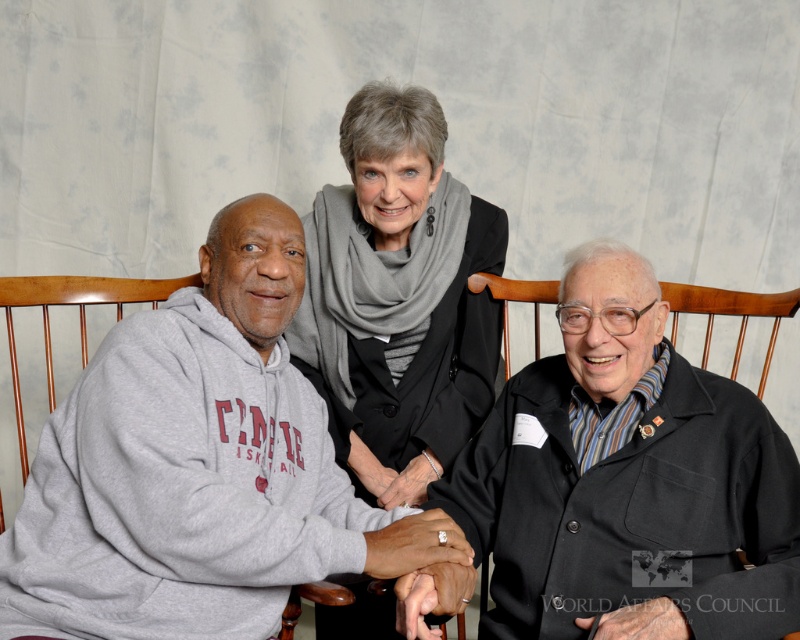
You are a photographer at an event and need to adjust the lighting so that both the gray hoodie at left and the gray wool scarf at center are equally visible. Considering their sizes, which object requires more light to achieve this?

The gray hoodie at left is shorter than the gray wool scarf at center, so it requires more light to ensure it is as visible as the scarf.

You are a photographer at an event and need to adjust the lighting to ensure both the gray hoodie at left and the black wool coat at right are well illuminated. Given their height difference, which object should you position closer to the light source?

The gray hoodie at left is much taller than the black wool coat at right, so you should position the gray hoodie at left closer to the light source to ensure both receive adequate illumination.

You are a photographer trying to capture a group photo of the gray hoodie at left and the black wool coat at right. The camera you are using has a minimum focusing distance of 16 inches. Can you take a clear photo of both subjects without moving them?

The gray hoodie at left is 16.29 inches from the black wool coat at right. Since the camera requires a minimum focusing distance of 16 inches, the distance between them is sufficient for the camera to focus on both subjects. Therefore, you can take a clear photo without moving them.